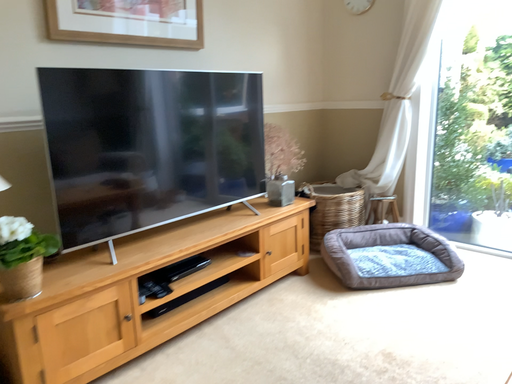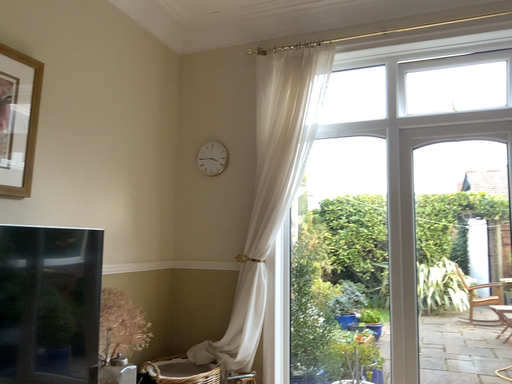
Question: Which way did the camera rotate in the video?

Choices:
 (A) rotated downward
 (B) rotated upward

Answer: (B)